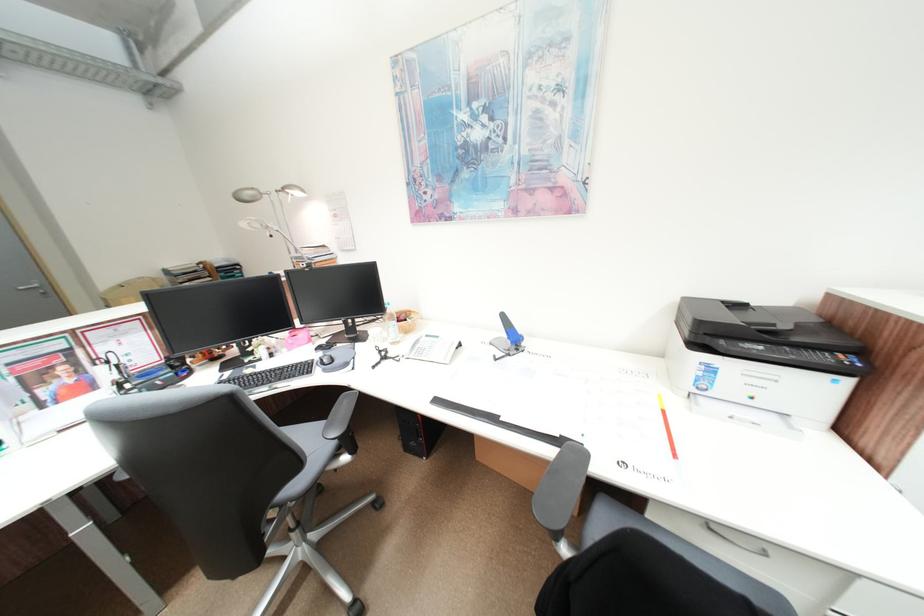
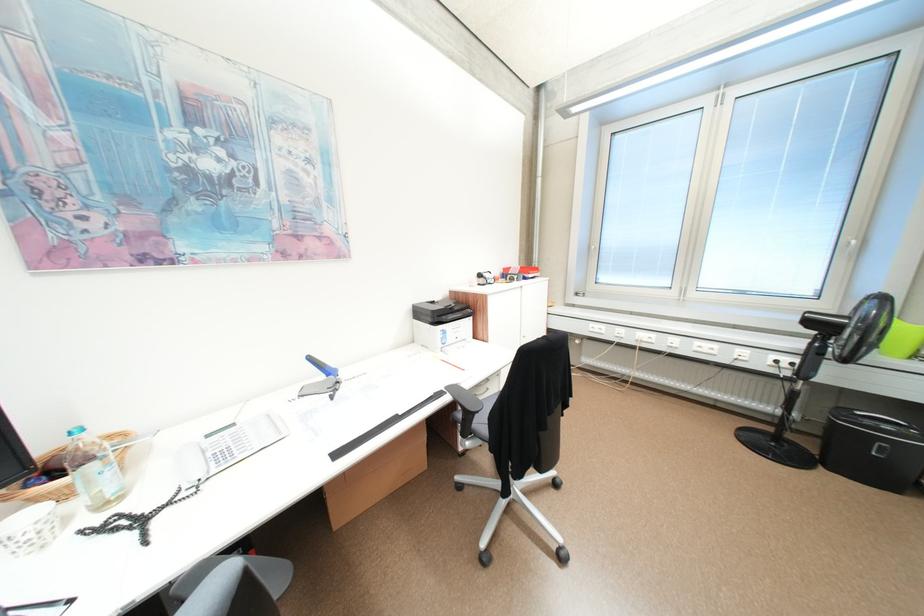
Question: Based on the continuous images, in which direction is the camera rotating? Reply with the corresponding letter.

Choices:
 (A) Left
 (B) Right
 (C) Up
 (D) Down

Answer: (B)